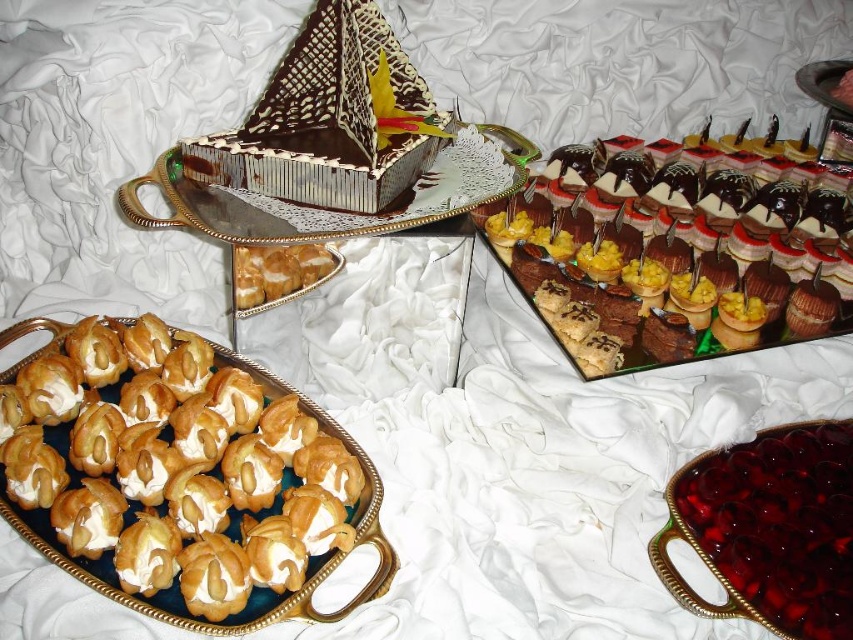
Question: Is chocolate-coated pastry at upper right closer to camera compared to chocolate-coated cake at upper center?

Choices:
 (A) no
 (B) yes

Answer: (A)

Question: Which object is the closest to the chocolate textured pyramid at upper left?

Choices:
 (A) chocolate-coated pastry at upper right
 (B) golden puff pastry at left
 (C) chocolate-coated cake at upper center
 (D) golden cream puff at lower left

Answer: (C)

Question: Which of these objects is positioned farthest from the chocolate textured pyramid at upper left?

Choices:
 (A) golden puff pastry at left
 (B) chocolate-coated pastry at upper right
 (C) chocolate-coated cake at upper center
 (D) golden cream puff at lower left

Answer: (B)

Question: Considering the real-world distances, which object is farthest from the chocolate-coated cake at upper center?

Choices:
 (A) golden cream puff at lower left
 (B) chocolate textured pyramid at upper left

Answer: (A)

Question: From the image, what is the correct spatial relationship of chocolate textured pyramid at upper left in relation to chocolate-coated cake at upper center?

Choices:
 (A) left
 (B) right

Answer: (A)

Question: In this image, where is chocolate-coated pastry at upper right located relative to golden cream puff at lower left?

Choices:
 (A) right
 (B) left

Answer: (A)